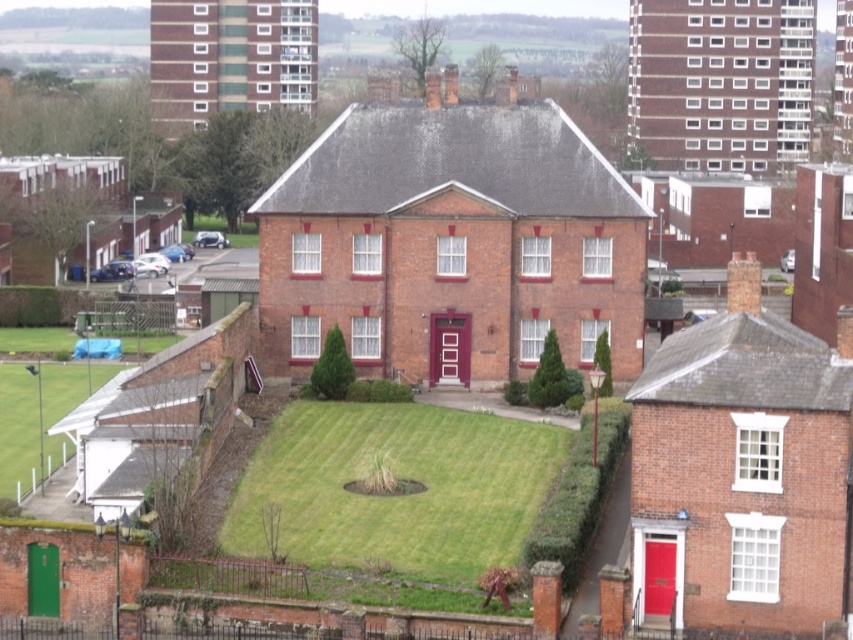
Question: Which of the following is the farthest from the observer?

Choices:
 (A) green grass at center
 (B) green grass at lower left

Answer: (B)

Question: Does green grass at center have a smaller size compared to green grass at lower left?

Choices:
 (A) no
 (B) yes

Answer: (B)

Question: Does green grass at center appear over green grass at lower left?

Choices:
 (A) no
 (B) yes

Answer: (A)

Question: Which point is closer to the camera?

Choices:
 (A) (463, 429)
 (B) (67, 339)

Answer: (A)

Question: Does green grass at center have a larger size compared to green grass at lower left?

Choices:
 (A) no
 (B) yes

Answer: (A)

Question: Which point is farther to the camera?

Choices:
 (A) green grass at lower left
 (B) green grass at center

Answer: (A)